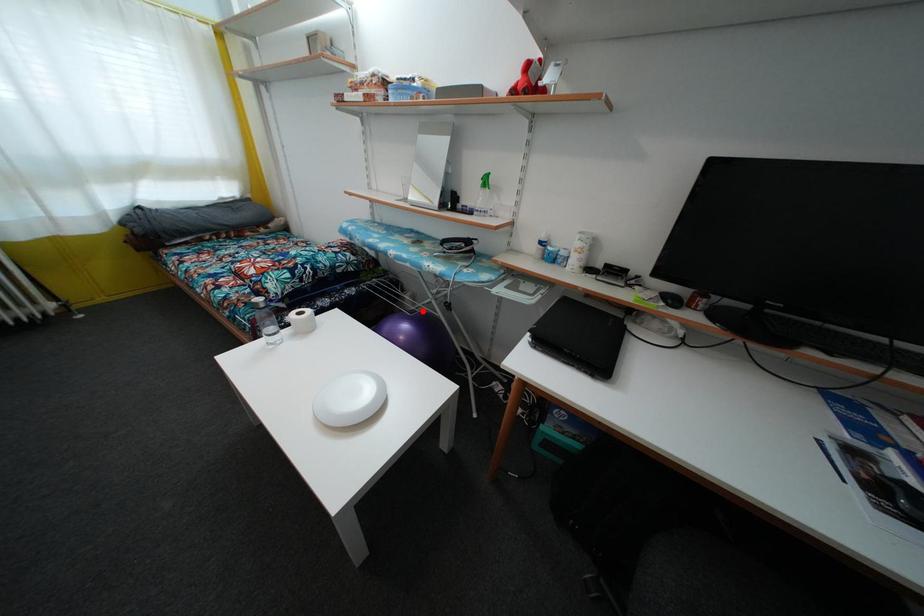
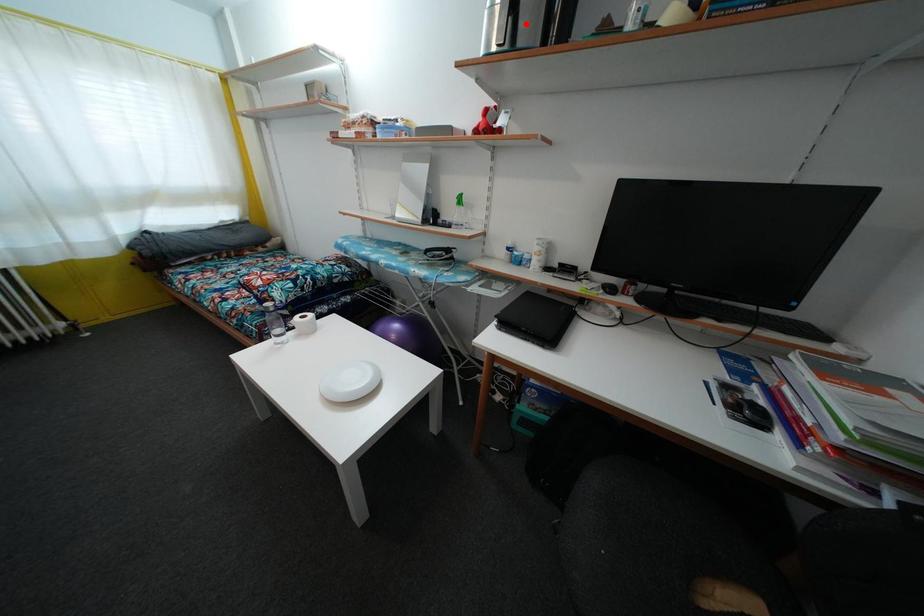
I am providing you with two images of the same scene from different viewpoints. A red point is marked on the first image and another point is marked on the second image. Is the red point in image1 aligned with the point shown in image2?

No